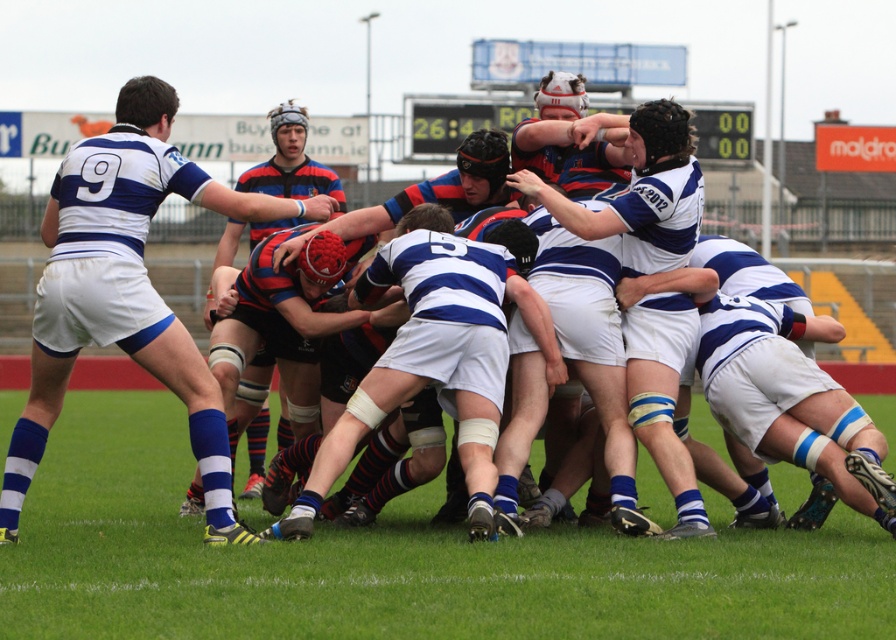
Is point (220, 458) in front of point (271, 129)?

That is True.

Who is positioned more to the right, white matte jersey at center or striped jersey at center?

From the viewer's perspective, white matte jersey at center appears more on the right side.

Is point (199, 365) positioned in front of point (217, 260)?

That is True.

Where is `white matte jersey at center`? white matte jersey at center is located at coordinates (126, 288).